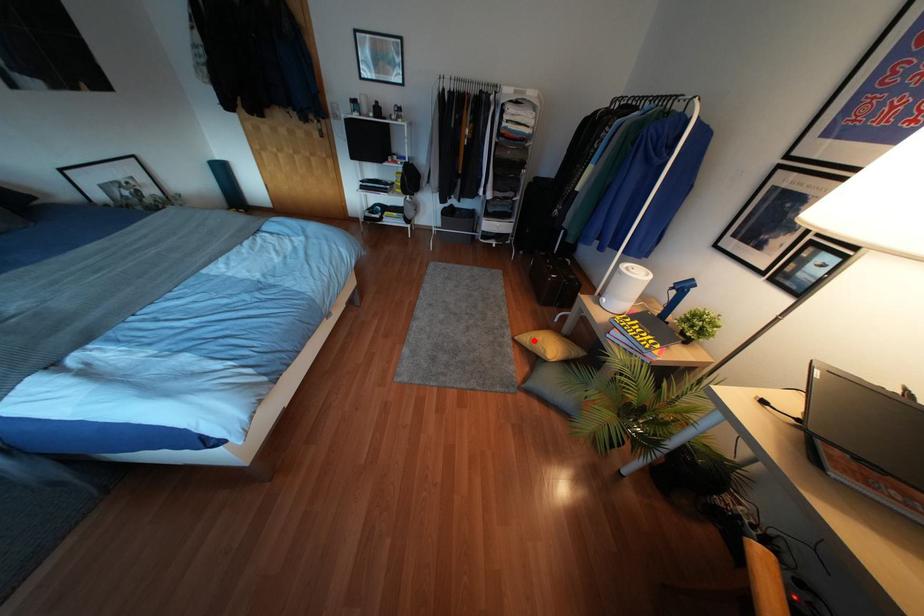
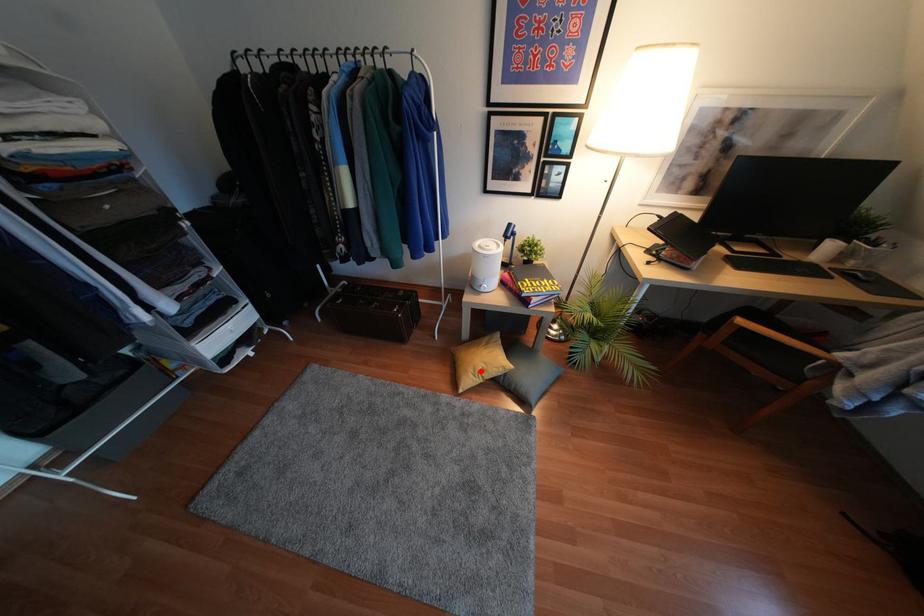
I am providing you with two images of the same scene from different viewpoints. A red point is marked on the first image and another point is marked on the second image. Does the point marked in image1 correspond to the same location as the one in image2?

Yes